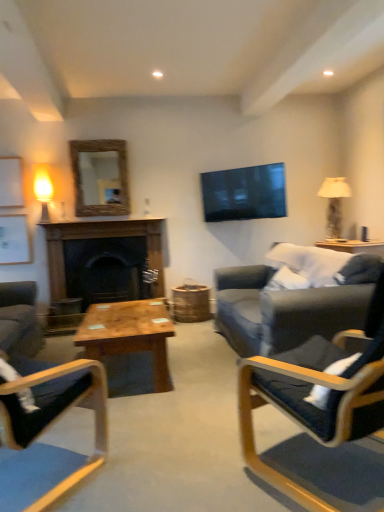
You are a GUI agent. You are given a task and a screenshot of the screen. Output one action in this format:
    pyautogui.click(x=<x>, y=<y>)
    Task: Click on the vacant area that lies to the right of wooden coffee table at center
    The height and width of the screenshot is (512, 384).
    Given the screenshot: What is the action you would take?
    pyautogui.click(x=200, y=364)